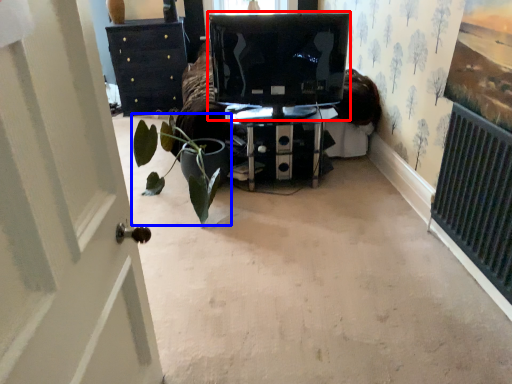
Question: Which object appears closest to the camera in this image, computer monitor (highlighted by a red box) or houseplant (highlighted by a blue box)?

Choices:
 (A) computer monitor
 (B) houseplant

Answer: (B)